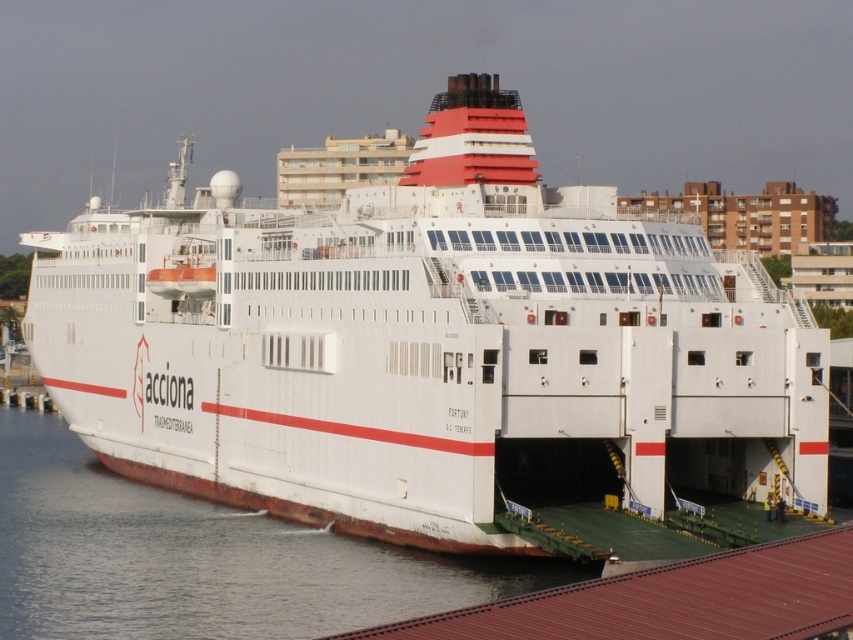
Who is more distant from viewer, (701, 476) or (289, 602)?

Positioned behind is point (701, 476).

Between white matte ship at center and white water at lower left, which one appears on the left side from the viewer's perspective?

white matte ship at center

Image resolution: width=853 pixels, height=640 pixels. Find the location of `white matte ship at center`. white matte ship at center is located at coordinates (439, 355).

Image resolution: width=853 pixels, height=640 pixels. Identify the location of white matte ship at center. (439, 355).

The width and height of the screenshot is (853, 640). What do you see at coordinates (439, 355) in the screenshot?
I see `white matte ship at center` at bounding box center [439, 355].

Is point (752, 321) closer to viewer compared to point (598, 637)?

No, (752, 321) is further to viewer.

Locate an element on the screen. white matte ship at center is located at coordinates (439, 355).

Can you confirm if white water at lower left is wider than brown corrugated metal dock at lower right?

Indeed, white water at lower left has a greater width compared to brown corrugated metal dock at lower right.

Between white water at lower left and brown corrugated metal dock at lower right, which one has less height?

With less height is white water at lower left.

This screenshot has height=640, width=853. Find the location of `white water at lower left`. white water at lower left is located at coordinates (199, 557).